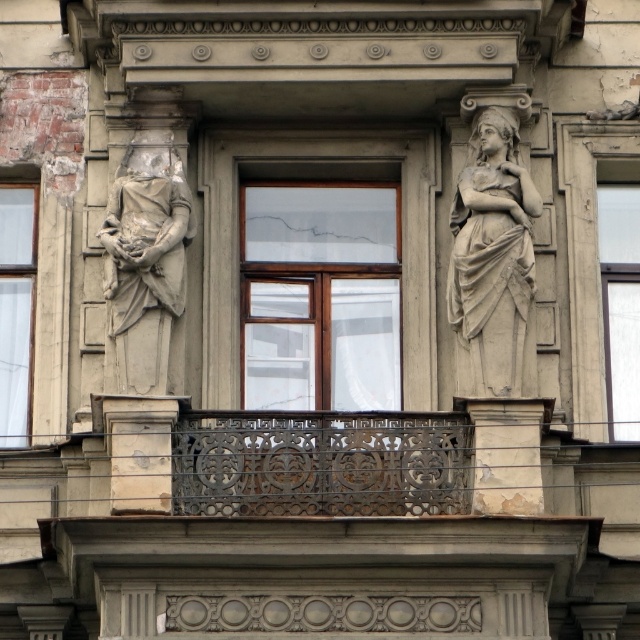
Who is lower down, gray stone statue at right or transparent glass window at right?

Positioned lower is gray stone statue at right.

The image size is (640, 640). What are the coordinates of `gray stone statue at right` in the screenshot? It's located at (493, 257).

Which is behind, point (316, 376) or point (458, 403)?

The point (316, 376) is behind.

Is point (250, 310) positioned behind point (488, 416)?

Yes, point (250, 310) is farther from viewer.

Does point (326, 216) lie behind point (536, 451)?

That is True.

Identify the location of wooden frame at center. The width and height of the screenshot is (640, 640). (321, 298).

Can you confirm if wooden frame at center is wider than white glass window at left?

Incorrect, wooden frame at center's width does not surpass white glass window at left's.

Between point (342, 284) and point (8, 257), which one is positioned in front?

Point (342, 284) is in front.

This screenshot has height=640, width=640. In order to click on wooden frame at center in this screenshot , I will do `click(321, 298)`.